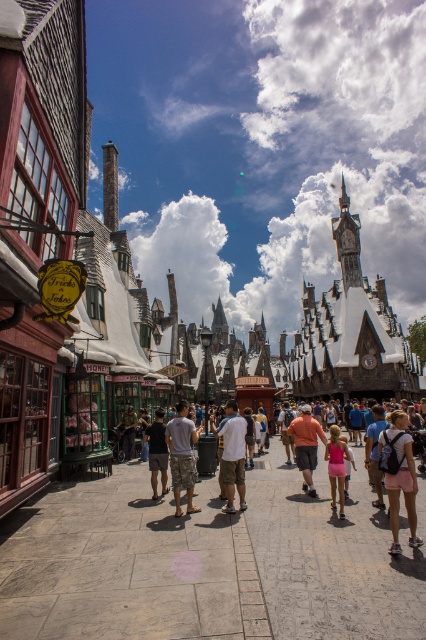
Is camouflage shorts at center in front of orange cotton t-shirt at center?

Yes, camouflage shorts at center is closer to the viewer.

Can you confirm if camouflage shorts at center is positioned to the right of orange cotton t-shirt at center?

In fact, camouflage shorts at center is to the left of orange cotton t-shirt at center.

Where is `camouflage shorts at center`? Image resolution: width=426 pixels, height=640 pixels. camouflage shorts at center is located at coordinates (181, 456).

Who is shorter, gray stone pavement at center or white cotton shirt at center?

Standing shorter between the two is gray stone pavement at center.

Is point (298, 637) behind point (233, 448)?

No, (298, 637) is closer to viewer.

Between point (8, 532) and point (241, 493), which one is positioned in front?

Positioned in front is point (8, 532).

Identify the location of gray stone pavement at center. (207, 563).

Who is taller, pink fabric backpack at lower right or camouflage shorts at center?

With more height is pink fabric backpack at lower right.

Is pink fabric backpack at lower right closer to the viewer compared to camouflage shorts at center?

That is True.

Does point (394, 506) come behind point (184, 435)?

No, (394, 506) is closer to viewer.

This screenshot has width=426, height=640. Identify the location of pink fabric backpack at lower right. (399, 476).